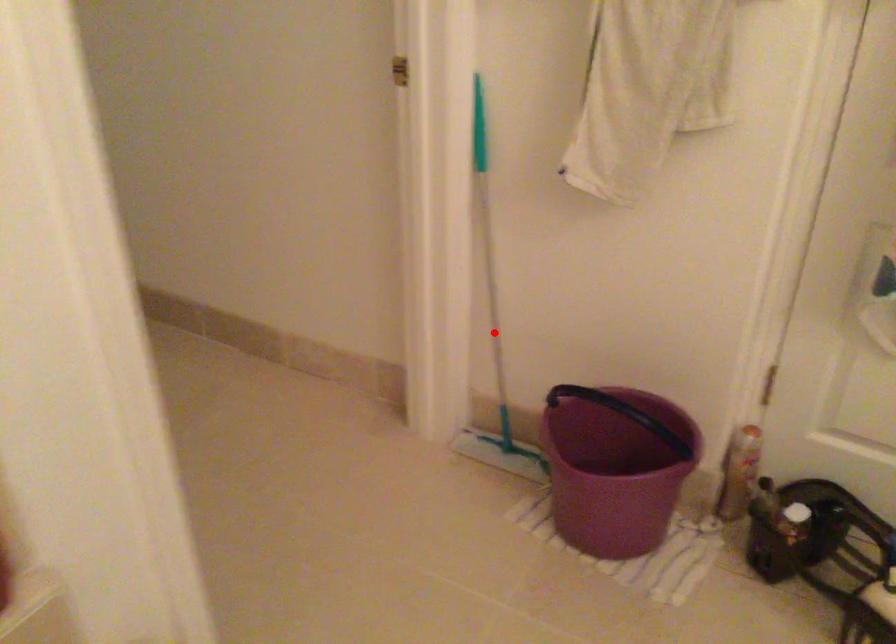
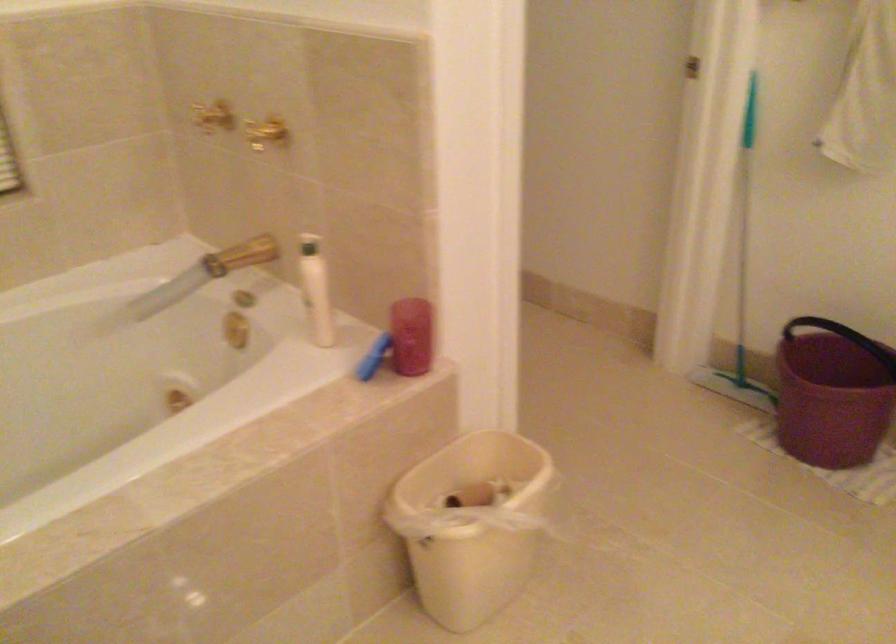
Question: I am providing you with two images of the same scene from different viewpoints. Given a red point in image1, look at the same physical point in image2. Is it:

Choices:
 (A) Closer to the viewpoint
 (B) Farther from the viewpoint

Answer: (B)